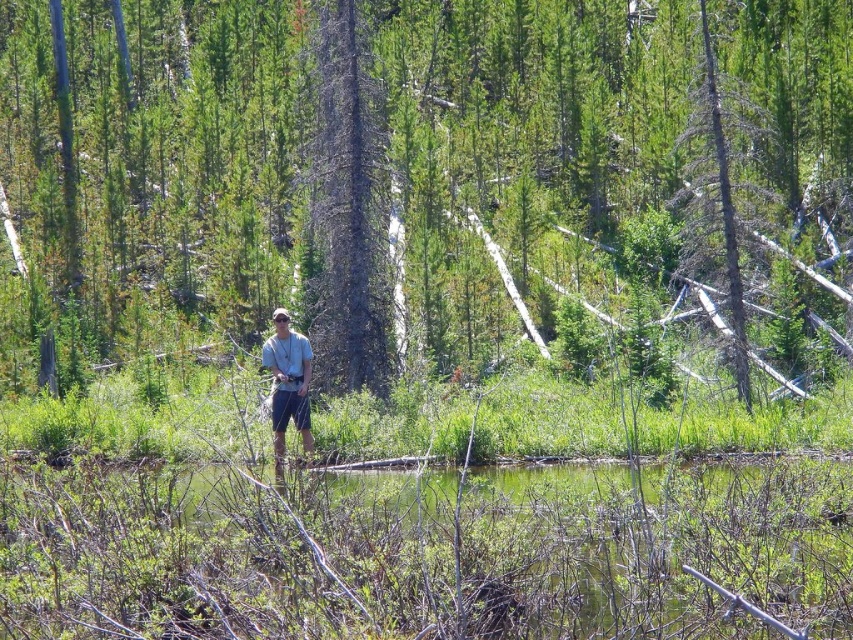
Question: Among these points, which one is nearest to the camera?

Choices:
 (A) (270, 340)
 (B) (398, 564)
 (C) (682, 224)

Answer: (B)

Question: Is light gray t-shirt at center behind dead wood tree at upper right?

Choices:
 (A) yes
 (B) no

Answer: (B)

Question: Is green textured tree at center in front of dead wood tree at upper right?

Choices:
 (A) yes
 (B) no

Answer: (A)

Question: Which object is positioned farthest from the dead wood tree at upper right?

Choices:
 (A) light gray t-shirt at center
 (B) green textured tree at center
 (C) dark gray bark tree at center
 (D) green liquid water at center

Answer: (D)

Question: Which point is closer to the camera?

Choices:
 (A) dark gray bark tree at center
 (B) light gray t-shirt at center

Answer: (B)

Question: Is green textured tree at center positioned behind green liquid water at center?

Choices:
 (A) yes
 (B) no

Answer: (A)